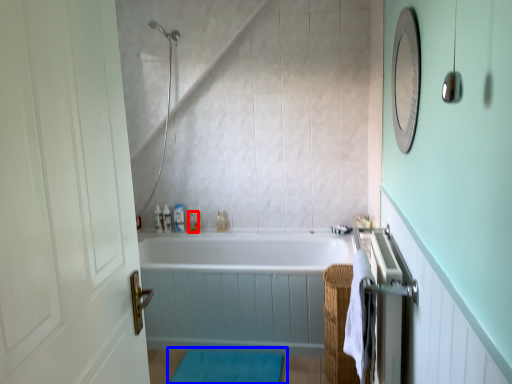
Question: Which of the following is the farthest to the observer, toiletry (highlighted by a red box) or bath mat (highlighted by a blue box)?

Choices:
 (A) toiletry
 (B) bath mat

Answer: (A)